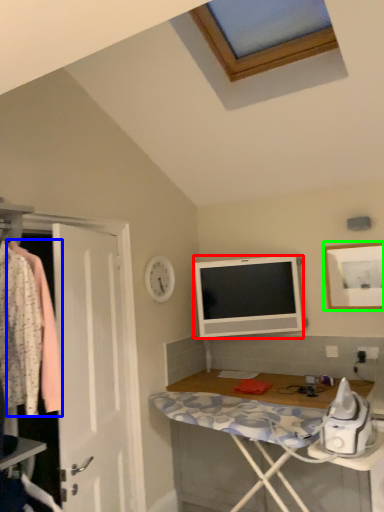
Question: Which object is the farthest from television (highlighted by a red box)? Choose among these: clothing (highlighted by a blue box) or picture frame (highlighted by a green box).

Choices:
 (A) clothing
 (B) picture frame

Answer: (A)